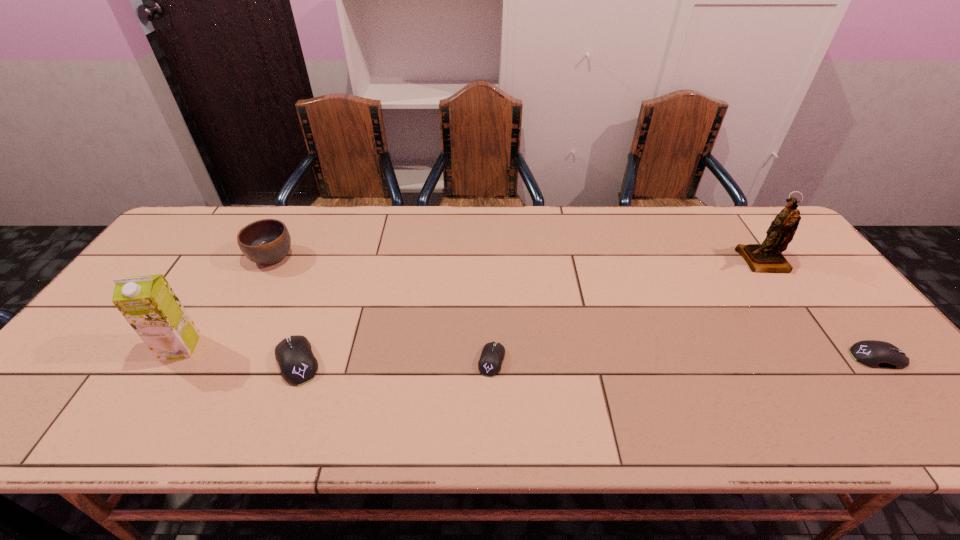
You are a GUI agent. You are given a task and a screenshot of the screen. Output one action in this format:
    pyautogui.click(x=<x>, y=<y>)
    Task: Click on the figurine present at the right edge
    
    Given the screenshot: What is the action you would take?
    pyautogui.click(x=767, y=257)

The image size is (960, 540). I want to click on object located at the far right corner, so click(767, 257).

At what (x,y) coordinates should I click in order to perform the action: click on object located in the near right corner section of the desktop. Please return your answer as a coordinate pair (x, y). This screenshot has height=540, width=960. Looking at the image, I should click on (876, 354).

In the image, there is a desktop. Identify the location of free space at the far edge. This screenshot has width=960, height=540. (474, 216).

You are a GUI agent. You are given a task and a screenshot of the screen. Output one action in this format:
    pyautogui.click(x=<x>, y=<y>)
    Task: Click on the free spot at the near edge of the desktop
    The height and width of the screenshot is (540, 960).
    Given the screenshot: What is the action you would take?
    pyautogui.click(x=566, y=394)

Where is `unoccupied area between the third object from right to left and the leftmost computer equipment`? unoccupied area between the third object from right to left and the leftmost computer equipment is located at coordinates (395, 361).

At what (x,y) coordinates should I click in order to perform the action: click on free space that is in between the rightmost computer equipment and the figurine. Please return your answer as a coordinate pair (x, y). The width and height of the screenshot is (960, 540). Looking at the image, I should click on (821, 309).

Locate an element on the screen. vacant area between the fourth shortest object and the figurine is located at coordinates (517, 259).

This screenshot has height=540, width=960. Identify the location of vacant area between the figurine and the soya milk. (471, 304).

Image resolution: width=960 pixels, height=540 pixels. What are the coordinates of `unoccupied area between the soya milk and the shortest computer equipment` in the screenshot? It's located at (336, 354).